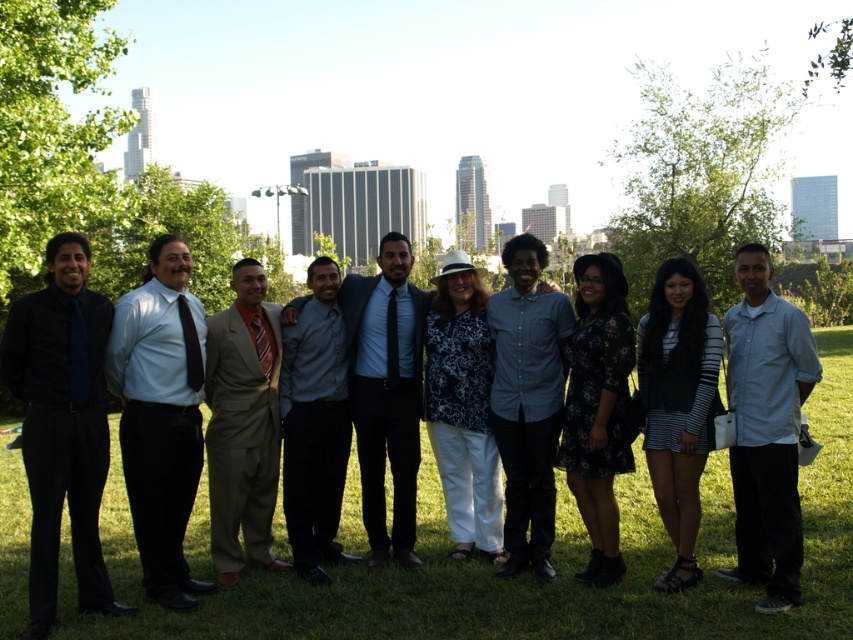
Identify the location of matte blue shirt at center. [160, 416].

Is matte blue shirt at center wider than gray matte shirt at center?

Yes.

You are a GUI agent. You are given a task and a screenshot of the screen. Output one action in this format:
    pyautogui.click(x=<x>, y=<y>)
    Task: Click on the matte blue shirt at center
    The height and width of the screenshot is (640, 853).
    Given the screenshot: What is the action you would take?
    pyautogui.click(x=160, y=416)

This screenshot has height=640, width=853. Find the location of `matte blue shirt at center`. matte blue shirt at center is located at coordinates (160, 416).

Is point (775, 401) closer to camera compared to point (596, 420)?

That is True.

Who is shorter, light blue shirt at center or floral dress at center?

With less height is light blue shirt at center.

The image size is (853, 640). In order to click on light blue shirt at center in this screenshot , I will do `click(766, 429)`.

How far apart are matte black shirt at left and light blue shirt at center?

matte black shirt at left is 9.62 meters from light blue shirt at center.

Does point (100, 609) come in front of point (770, 461)?

No, (100, 609) is behind (770, 461).

Which is in front, point (16, 368) or point (743, 317)?

Positioned in front is point (16, 368).

What are the coordinates of `matte black shirt at left` in the screenshot? It's located at (62, 424).